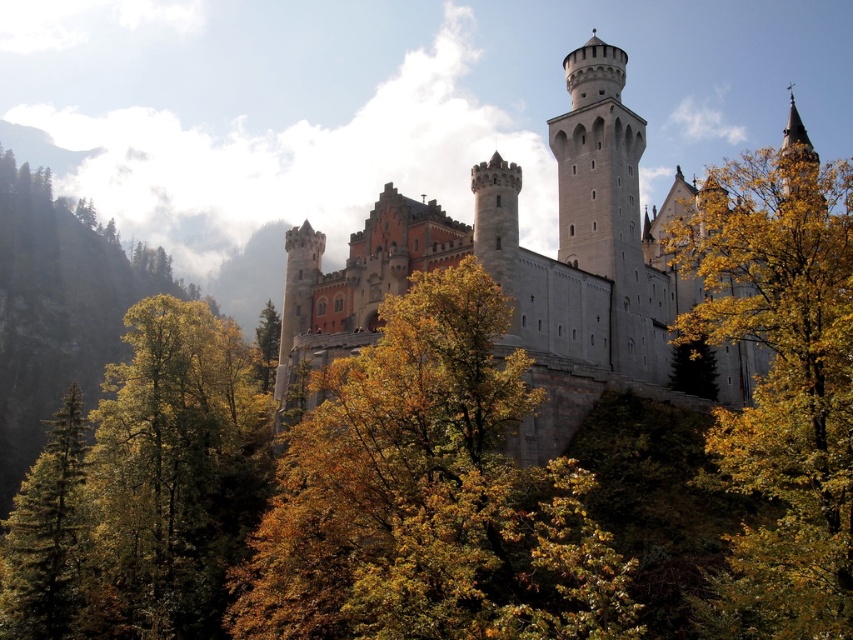
Question: Which object is closer to the camera taking this photo?

Choices:
 (A) green leafy tree at center-left
 (B) green coniferous tree at lower left

Answer: (B)

Question: Which object is farther from the camera taking this photo?

Choices:
 (A) white stone tower at upper center
 (B) yellow-green leaves at upper right

Answer: (A)

Question: Is green leafy tree at lower left below white stone tower at upper center?

Choices:
 (A) yes
 (B) no

Answer: (A)

Question: Can you confirm if white stone castle at center is smaller than green coniferous tree at lower left?

Choices:
 (A) no
 (B) yes

Answer: (B)

Question: Is yellow-green leaves at upper right below green leafy tree at center-left?

Choices:
 (A) no
 (B) yes

Answer: (A)

Question: Estimate the real-world distances between objects in this image. Which object is farther from the white stone castle at center?

Choices:
 (A) golden leafy tree at center
 (B) yellow-green leaves at upper right

Answer: (A)